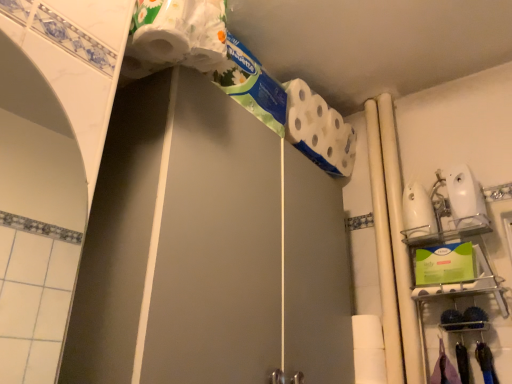
What are the coordinates of `white glossy screen door at upper center` in the screenshot? It's located at (244, 253).

This screenshot has width=512, height=384. Describe the element at coordinates (244, 253) in the screenshot. I see `white glossy screen door at upper center` at that location.

Locate an element on the screen. The height and width of the screenshot is (384, 512). white glossy beam at right, which ranks as the first beam in right-to-left order is located at coordinates (399, 242).

Can you confirm if white matte toilet paper at upper center is smaller than white glossy screen door at upper center?

Yes.

From a real-world perspective, which object stands above the other?

white matte toilet paper at upper center is physically above.

Looking at this image, are white matte toilet paper at upper center and white glossy screen door at upper center beside each other?

No, white matte toilet paper at upper center is not next to white glossy screen door at upper center.

Considering the sizes of objects white matte toilet paper at upper center and white glossy screen door at upper center in the image provided, who is thinner, white matte toilet paper at upper center or white glossy screen door at upper center?

With smaller width is white matte toilet paper at upper center.

Can we say white matte toilet paper at upper center lies outside white matte pipe at center right, positioned as the 2th beam in right-to-left order?

white matte toilet paper at upper center is positioned outside white matte pipe at center right, positioned as the 2th beam in right-to-left order.

Looking at this image, who is taller, white matte toilet paper at upper center or white matte pipe at center right, positioned as the 2th beam in right-to-left order?

white matte pipe at center right, positioned as the 2th beam in right-to-left order.

Which object is thinner, white matte toilet paper at upper center or white matte pipe at center right, positioned as the 2th beam in right-to-left order?

With smaller width is white matte pipe at center right, positioned as the 2th beam in right-to-left order.

This screenshot has width=512, height=384. Identify the location of the 2nd beam located beneath the white matte toilet paper at upper center (from a real-world perspective). (384, 249).

Is white glossy screen door at upper center to the right of white glossy beam at right, which ranks as the first beam in right-to-left order, from the viewer's perspective?

No, white glossy screen door at upper center is not to the right of white glossy beam at right, which ranks as the first beam in right-to-left order.

This screenshot has width=512, height=384. Identify the location of screen door on the left of white glossy beam at right, which ranks as the first beam in right-to-left order. (244, 253).

Which of these two, white glossy screen door at upper center or white glossy beam at right, which ranks as the first beam in right-to-left order, is wider?

white glossy screen door at upper center.

Does white glossy screen door at upper center have a greater height compared to white glossy beam at right, acting as the second beam starting from the left?

In fact, white glossy screen door at upper center may be shorter than white glossy beam at right, acting as the second beam starting from the left.

Does point (281, 295) come farther from viewer compared to point (314, 120)?

That is False.

From a real-world perspective, is white glossy screen door at upper center on white matte toilet paper at upper center?

No, from a real-world perspective, white glossy screen door at upper center is not above white matte toilet paper at upper center.

Considering the relative sizes of white glossy screen door at upper center and white matte toilet paper at upper center in the image provided, is white glossy screen door at upper center smaller than white matte toilet paper at upper center?

Incorrect, white glossy screen door at upper center is not smaller in size than white matte toilet paper at upper center.

Is white matte pipe at center right, the 1th beam in the left-to-right sequence, oriented away from white glossy screen door at upper center?

No.

Looking at the image, does white matte pipe at center right, the 1th beam in the left-to-right sequence, seem bigger or smaller compared to white glossy screen door at upper center?

Considering their sizes, white matte pipe at center right, the 1th beam in the left-to-right sequence, takes up less space than white glossy screen door at upper center.

In the scene shown: Which point is more distant from viewer, (392, 314) or (161, 362)?

Positioned behind is point (392, 314).

Does white matte pipe at center right, the 1th beam in the left-to-right sequence, have a lesser height compared to white glossy screen door at upper center?

Incorrect, the height of white matte pipe at center right, the 1th beam in the left-to-right sequence, does not fall short of that of white glossy screen door at upper center.

In terms of height, does white glossy screen door at upper center look taller or shorter compared to white matte pipe at center right, positioned as the 2th beam in right-to-left order?

Clearly, white glossy screen door at upper center is shorter compared to white matte pipe at center right, positioned as the 2th beam in right-to-left order.

Considering the sizes of objects white glossy screen door at upper center and white matte pipe at center right, the 1th beam in the left-to-right sequence, in the image provided, who is bigger, white glossy screen door at upper center or white matte pipe at center right, the 1th beam in the left-to-right sequence,?

Bigger between the two is white glossy screen door at upper center.

Looking at this image, is white glossy screen door at upper center outside of white matte pipe at center right, the 1th beam in the left-to-right sequence?

Absolutely, white glossy screen door at upper center is external to white matte pipe at center right, the 1th beam in the left-to-right sequence.

From the image's perspective, is white glossy screen door at upper center below white matte pipe at center right, the 1th beam in the left-to-right sequence?

Yes.

From a real-world perspective, is white glossy beam at right, which ranks as the first beam in right-to-left order, physically located above or below white matte toilet paper at upper center?

In terms of real-world spatial position, white glossy beam at right, which ranks as the first beam in right-to-left order, is below white matte toilet paper at upper center.

Considering the relative positions of white glossy beam at right, which ranks as the first beam in right-to-left order, and white matte toilet paper at upper center in the image provided, is white glossy beam at right, which ranks as the first beam in right-to-left order, behind white matte toilet paper at upper center?

That is False.

In the scene shown: Which object is wider, white glossy beam at right, which ranks as the first beam in right-to-left order, or white matte toilet paper at upper center?

Wider between the two is white matte toilet paper at upper center.

Is white glossy beam at right, acting as the second beam starting from the left, positioned beyond the bounds of white matte toilet paper at upper center?

Yes, white glossy beam at right, acting as the second beam starting from the left, is not within white matte toilet paper at upper center.

You are a GUI agent. You are given a task and a screenshot of the screen. Output one action in this format:
    pyautogui.click(x=<x>, y=<y>)
    Task: Click on the screen door below the white matte toilet paper at upper center (from the image's perspective)
    
    Given the screenshot: What is the action you would take?
    pyautogui.click(x=244, y=253)

There is a white matte pipe at center right, the 1th beam in the left-to-right sequence. At what (x,y) coordinates should I click in order to perform the action: click on toilet paper above it (from a real-world perspective). Please return your answer as a coordinate pair (x, y). The height and width of the screenshot is (384, 512). Looking at the image, I should click on (319, 130).

Which object lies nearer to the anchor point white glossy screen door at upper center, white glossy beam at right, acting as the second beam starting from the left, or white matte toilet paper at upper center?

white matte toilet paper at upper center is positioned closer to the anchor white glossy screen door at upper center.

Consider the image. Looking at the image, which one is located closer to white matte toilet paper at upper center, white glossy screen door at upper center or white matte pipe at center right, positioned as the 2th beam in right-to-left order?

white matte pipe at center right, positioned as the 2th beam in right-to-left order, is closer to white matte toilet paper at upper center.

From the image, which object appears to be nearer to white matte toilet paper at upper center, white glossy beam at right, which ranks as the first beam in right-to-left order, or white matte pipe at center right, the 1th beam in the left-to-right sequence?

The object closer to white matte toilet paper at upper center is white matte pipe at center right, the 1th beam in the left-to-right sequence.

Looking at the image, which one is located further to white glossy screen door at upper center, white glossy beam at right, which ranks as the first beam in right-to-left order, or white matte pipe at center right, the 1th beam in the left-to-right sequence?

white glossy beam at right, which ranks as the first beam in right-to-left order, is further to white glossy screen door at upper center.

Looking at the image, which one is located further to white matte pipe at center right, the 1th beam in the left-to-right sequence, white glossy screen door at upper center or white matte toilet paper at upper center?

white glossy screen door at upper center lies further to white matte pipe at center right, the 1th beam in the left-to-right sequence, than the other object.

Based on their spatial positions, is white glossy screen door at upper center or white glossy beam at right, which ranks as the first beam in right-to-left order, closer to white matte pipe at center right, positioned as the 2th beam in right-to-left order?

white glossy beam at right, which ranks as the first beam in right-to-left order, is positioned closer to the anchor white matte pipe at center right, positioned as the 2th beam in right-to-left order.

Estimate the real-world distances between objects in this image. Which object is further from white glossy beam at right, acting as the second beam starting from the left, white matte pipe at center right, the 1th beam in the left-to-right sequence, or white glossy screen door at upper center?

The object further to white glossy beam at right, acting as the second beam starting from the left, is white glossy screen door at upper center.

Looking at this image, from the image, which object appears to be nearer to white glossy screen door at upper center, white matte pipe at center right, the 1th beam in the left-to-right sequence, or white matte toilet paper at upper center?

Among the two, white matte toilet paper at upper center is located nearer to white glossy screen door at upper center.

You are a GUI agent. You are given a task and a screenshot of the screen. Output one action in this format:
    pyautogui.click(x=<x>, y=<y>)
    Task: Click on the beam between white matte toilet paper at upper center and white matte pipe at center right, the 1th beam in the left-to-right sequence, in the up-down direction
    The width and height of the screenshot is (512, 384).
    Given the screenshot: What is the action you would take?
    pyautogui.click(x=399, y=242)

Identify the location of beam between white glossy screen door at upper center and white matte pipe at center right, positioned as the 2th beam in right-to-left order, from front to back. The height and width of the screenshot is (384, 512). (399, 242).